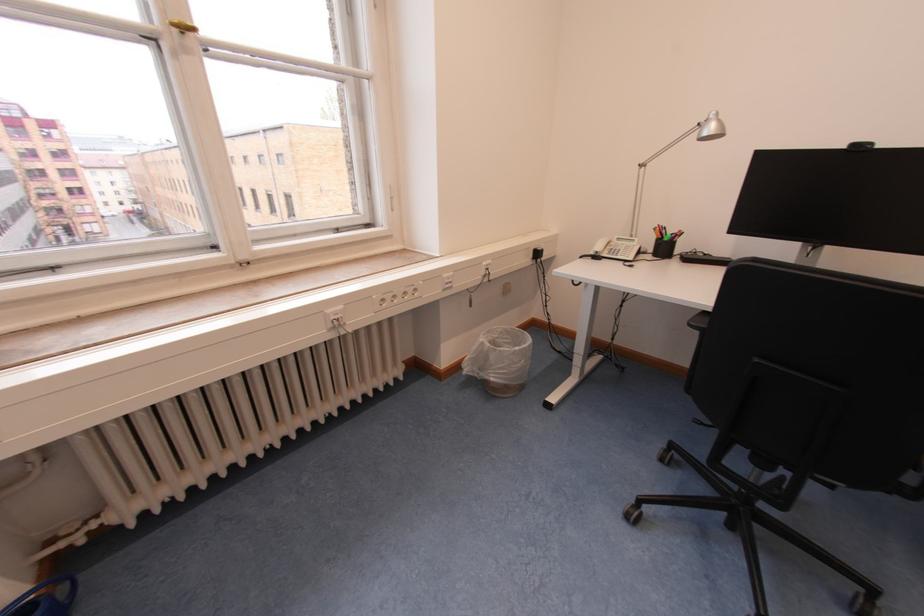
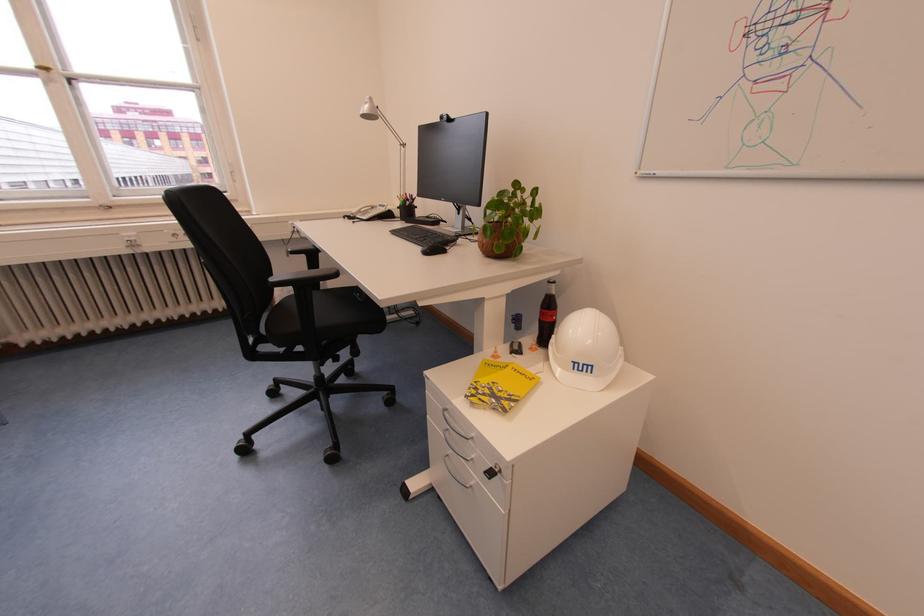
In the second image, find the point that corresponds to [344,320] in the first image.

(138, 241)